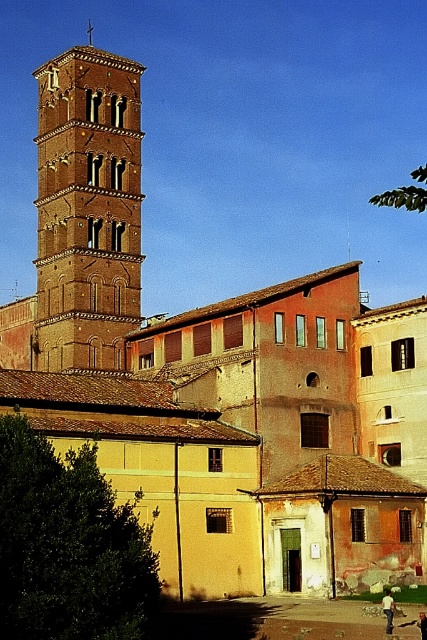
Is point (388, 609) closer to camera compared to point (417, 624)?

That is True.

Which of these two, white cotton shirt at lower right or dark blue jeans at lower right, stands shorter?

dark blue jeans at lower right

The height and width of the screenshot is (640, 427). I want to click on white cotton shirt at lower right, so click(x=388, y=609).

What are the coordinates of `white cotton shirt at lower right` in the screenshot? It's located at (388, 609).

What do you see at coordinates (87, 209) in the screenshot? I see `brick/tiled bell tower at center-left` at bounding box center [87, 209].

Does brick/tiled bell tower at center-left have a greater width compared to dark blue jeans at lower right?

Yes.

Where is `brick/tiled bell tower at center-left`? This screenshot has height=640, width=427. brick/tiled bell tower at center-left is located at coordinates (x=87, y=209).

Which is in front, point (125, 282) or point (388, 612)?

Positioned in front is point (388, 612).

Which is more to the right, brick/tiled bell tower at center-left or white cotton shirt at lower right?

Positioned to the right is white cotton shirt at lower right.

At what (x,y) coordinates should I click in order to perform the action: click on brick/tiled bell tower at center-left. Please return your answer as a coordinate pair (x, y). Looking at the image, I should click on (87, 209).